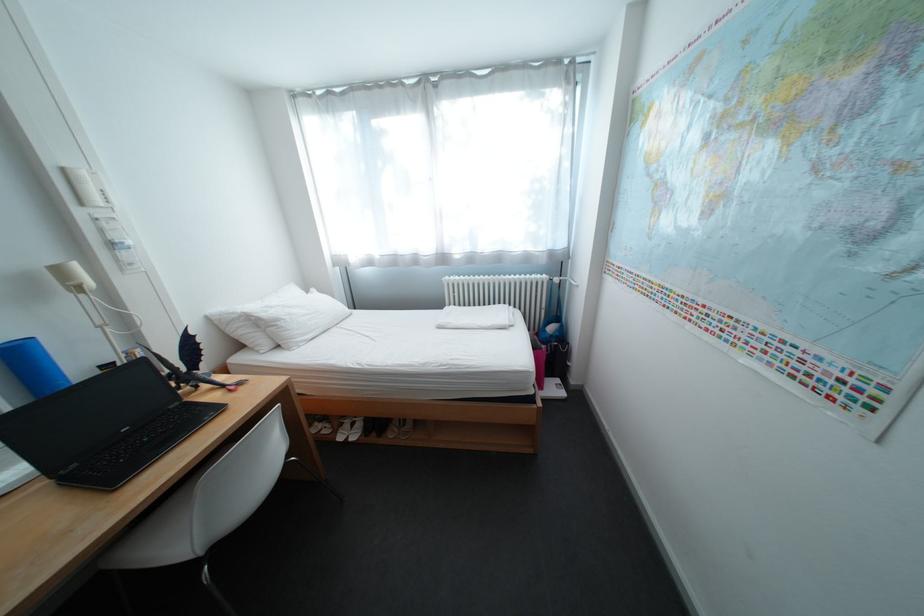
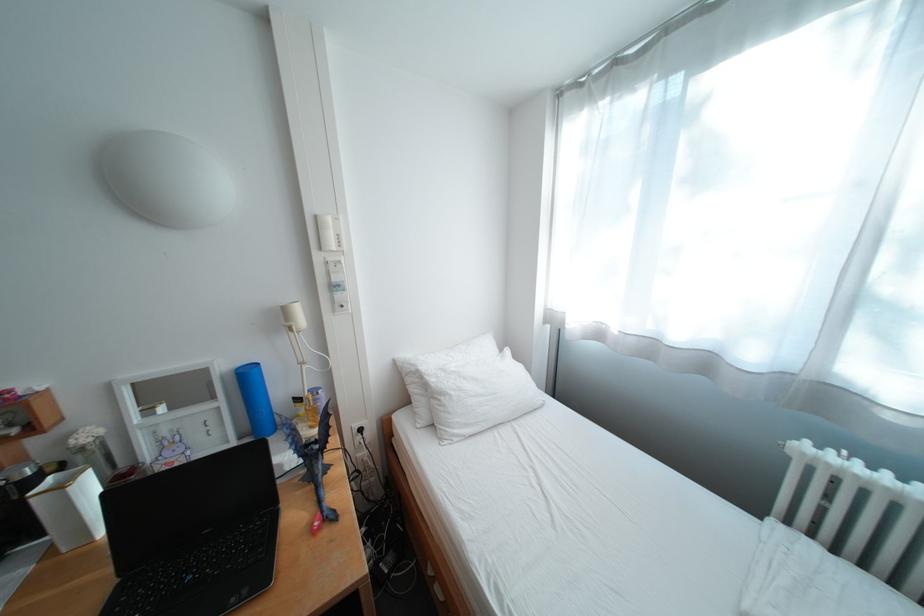
Question: The images are taken continuously from a first-person perspective. In which direction is your viewpoint rotating?

Choices:
 (A) Left
 (B) Right
 (C) Up
 (D) Down

Answer: (A)